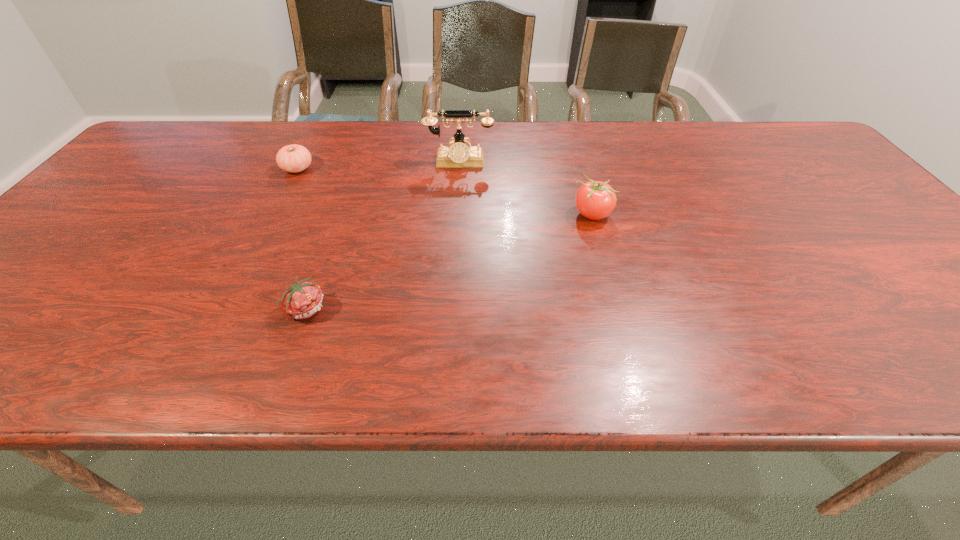
Where is `the second closest tomato to the rightmost tomato`? the second closest tomato to the rightmost tomato is located at coordinates (294, 158).

Where is `tomato that is the second closest one to the third object from right to left`? This screenshot has width=960, height=540. tomato that is the second closest one to the third object from right to left is located at coordinates (595, 200).

Where is `vacant space that satisfies the following two spatial constraints: 1. on the dial of the tallest tomato; 2. on the right side of the third object from left to right`? The width and height of the screenshot is (960, 540). vacant space that satisfies the following two spatial constraints: 1. on the dial of the tallest tomato; 2. on the right side of the third object from left to right is located at coordinates (455, 214).

Where is `vacant space that satisfies the following two spatial constraints: 1. on the dial of the third farthest object; 2. on the right side of the tallest object`? vacant space that satisfies the following two spatial constraints: 1. on the dial of the third farthest object; 2. on the right side of the tallest object is located at coordinates (455, 214).